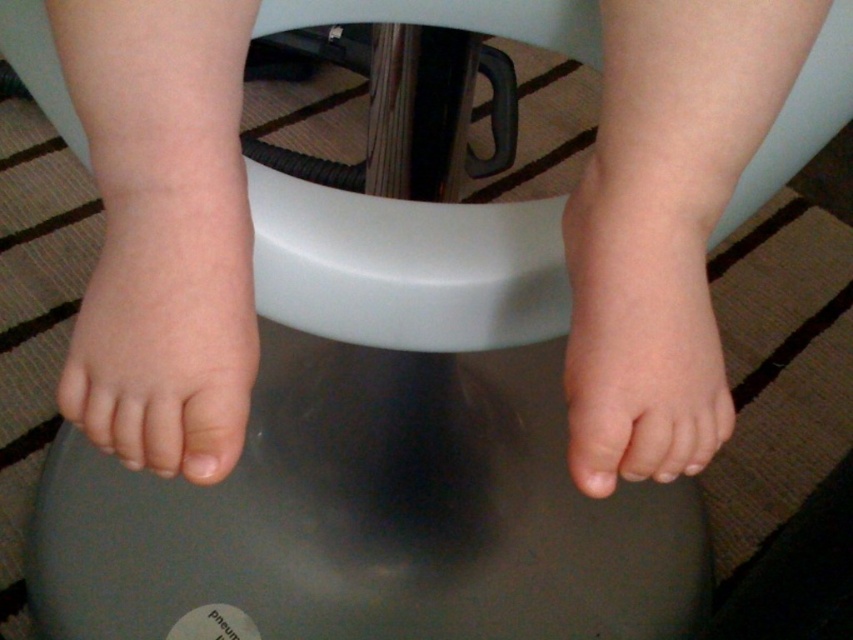
Question: Which of the following is the closest to the observer?

Choices:
 (A) pale pink flesh at center
 (B) skin smooth feet at center
 (C) smooth skin foot at center
 (D) pink smooth foot at lower left

Answer: (B)

Question: Can you confirm if skin smooth feet at center is bigger than pink smooth foot at lower left?

Choices:
 (A) no
 (B) yes

Answer: (B)

Question: Can you confirm if smooth skin foot at center is positioned to the right of pink smooth foot at lower left?

Choices:
 (A) no
 (B) yes

Answer: (B)

Question: Which point is farther from the camera taking this photo?

Choices:
 (A) (239, 337)
 (B) (142, 413)
 (C) (192, 449)

Answer: (A)

Question: Among these points, which one is nearest to the camera?

Choices:
 (A) (587, 227)
 (B) (207, 458)
 (C) (161, 244)

Answer: (B)

Question: Does smooth skin foot at center appear on the left side of pink smooth foot at lower left?

Choices:
 (A) yes
 (B) no

Answer: (B)